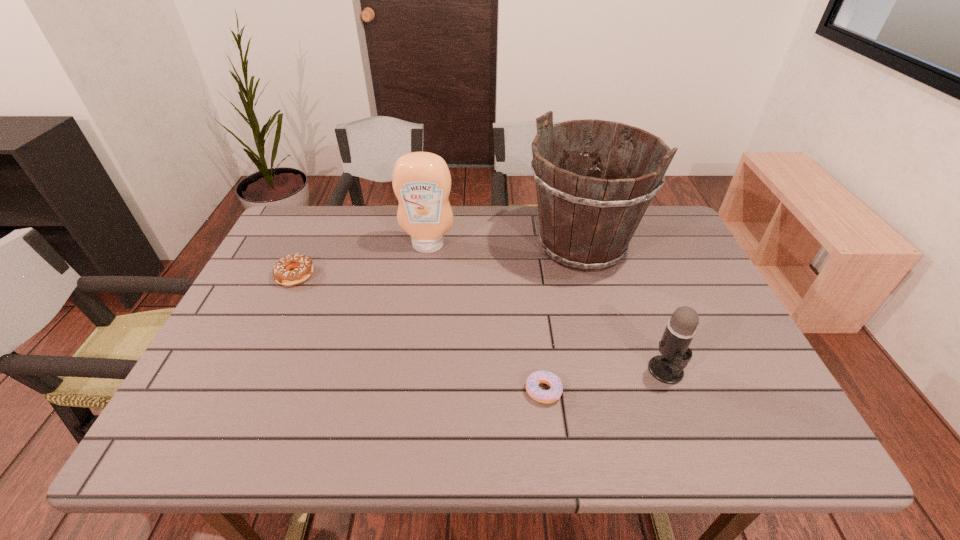
Where is `vacant space that satisfies the following two spatial constraints: 1. on the label of the fourth shortest object; 2. on the left side of the bucket`? This screenshot has height=540, width=960. vacant space that satisfies the following two spatial constraints: 1. on the label of the fourth shortest object; 2. on the left side of the bucket is located at coordinates (428, 246).